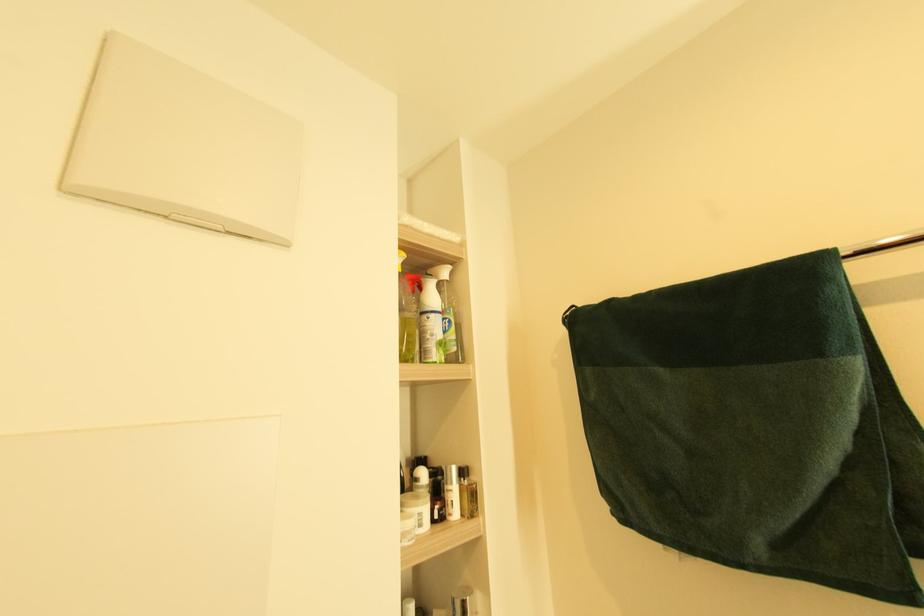
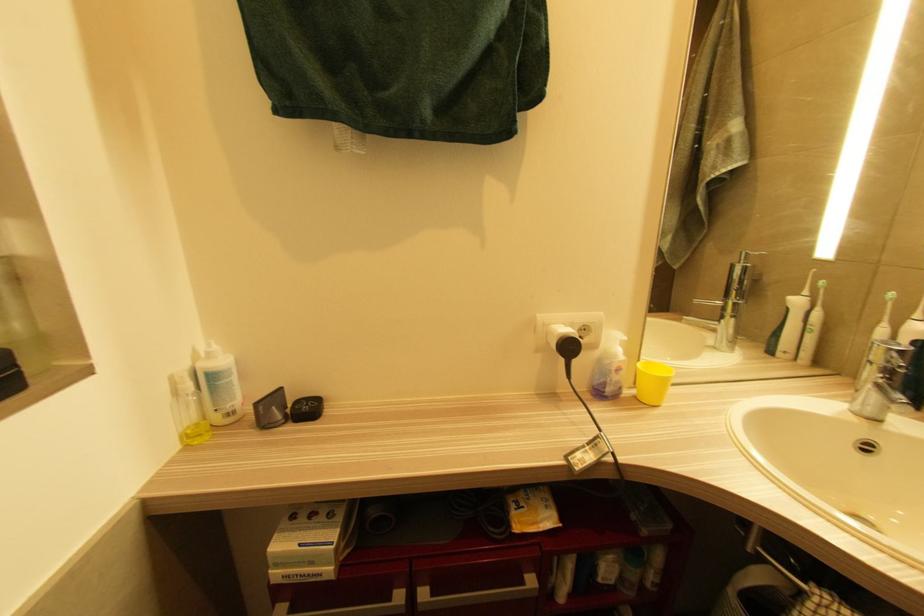
First-person continuous shooting, in which direction is the camera rotating?

The camera's rotation is toward right-down.